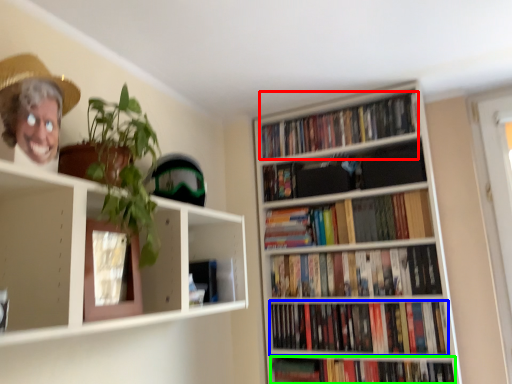
Question: Considering the real-world distances, which object is closest to book (highlighted by a red box)? book (highlighted by a blue box) or book (highlighted by a green box).

Choices:
 (A) book
 (B) book

Answer: (A)